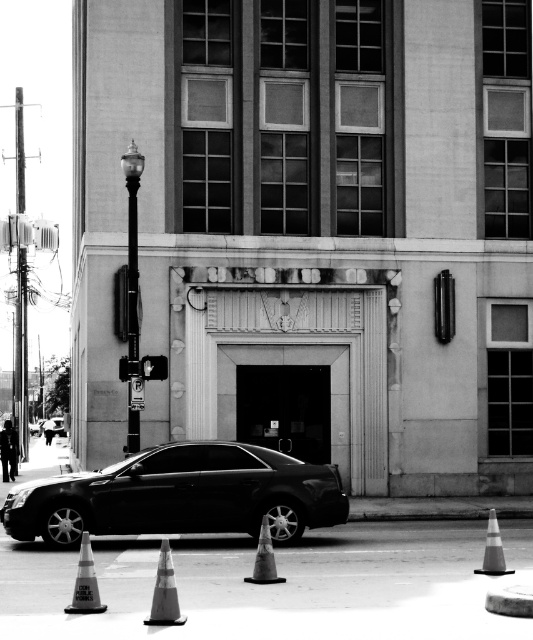
You are a pedestrian standing on the sidewalk in front of the large building. You see an orange reflective traffic cone at lower center and a smooth gray cone at center. Which cone is closer to you?

The orange reflective traffic cone at lower center is closer to you because it is in front of the smooth gray cone at center.

You are a delivery person who needs to park your van near the reflective orange cone at lower left and the smooth gray cone at center. Considering their heights, which cone should you avoid hitting to prevent damage to your van?

You should avoid hitting the reflective orange cone at lower left because it is much taller than the smooth gray cone at center, making it more likely to cause damage to your van.